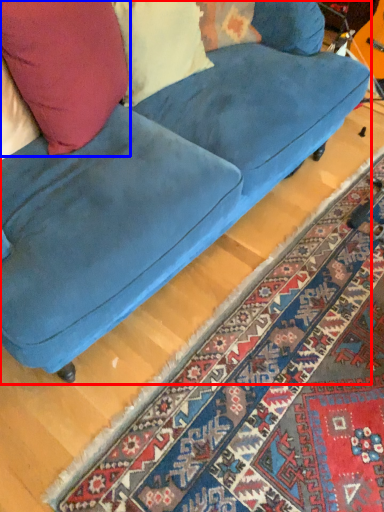
Question: Which of the following is the farthest to the observer, studio couch (highlighted by a red box) or throw pillow (highlighted by a blue box)?

Choices:
 (A) studio couch
 (B) throw pillow

Answer: (B)